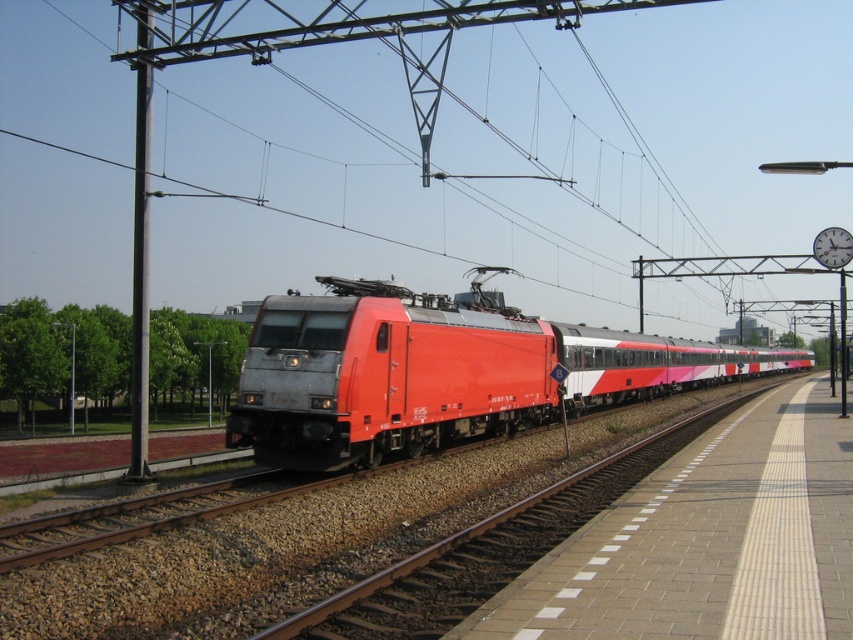
Is point (451, 397) closer to viewer compared to point (741, 598)?

No, (451, 397) is behind (741, 598).

Locate an element on the screen. This screenshot has width=853, height=640. metallic red train at center is located at coordinates tap(442, 371).